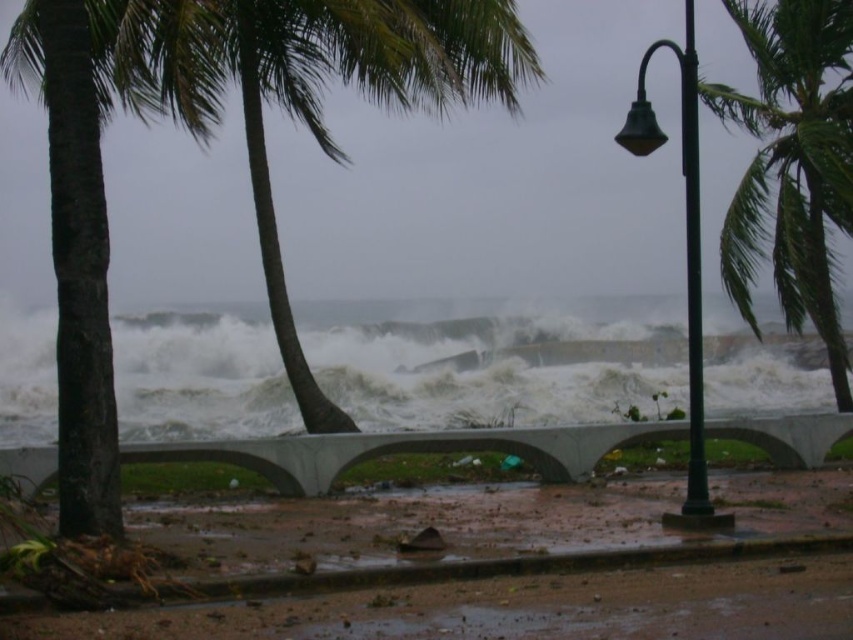
What do you see at coordinates (505, 566) in the screenshot? Image resolution: width=853 pixels, height=640 pixels. I see `brown dirt at lower center` at bounding box center [505, 566].

Is point (206, 609) farther from camera compared to point (296, 20)?

No.

Who is more forward, (473, 572) or (300, 90)?

Point (473, 572) is in front.

Find the location of a particular element. This screenshot has height=640, width=853. brown dirt at lower center is located at coordinates (505, 566).

Does brown dirt at lower center have a larger size compared to green leafy palm tree at upper right?

Actually, brown dirt at lower center might be smaller than green leafy palm tree at upper right.

Looking at this image, between brown dirt at lower center and green leafy palm tree at upper right, which one is positioned higher?

Positioned higher is green leafy palm tree at upper right.

What are the coordinates of `brown dirt at lower center` in the screenshot? It's located at pyautogui.click(x=505, y=566).

The width and height of the screenshot is (853, 640). What do you see at coordinates (505, 566) in the screenshot? I see `brown dirt at lower center` at bounding box center [505, 566].

Measure the distance between brown dirt at lower center and white frothy wave at center.

→ 22.51 meters

Find the location of `brown dirt at lower center`. brown dirt at lower center is located at coordinates (505, 566).